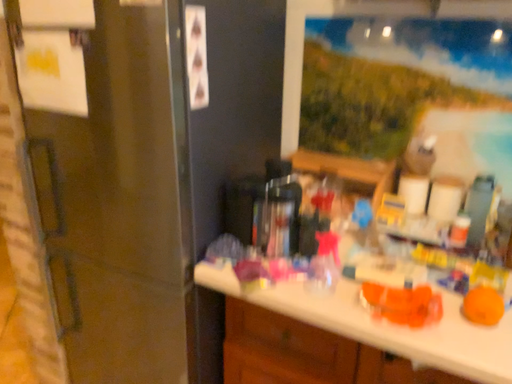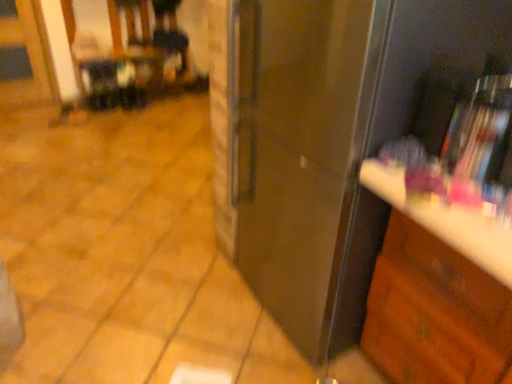
Question: How did the camera likely rotate when shooting the video?

Choices:
 (A) rotated right
 (B) rotated left

Answer: (B)